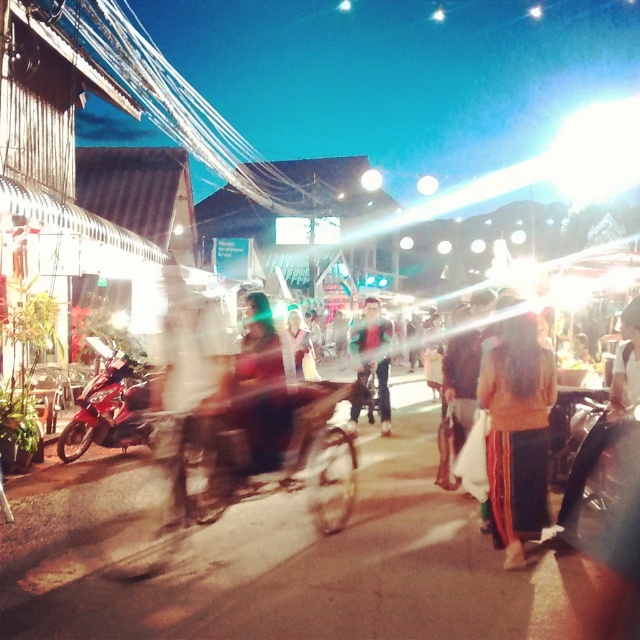
You are standing at the entrance of the market and see the brown fabric skirt at center. If you walk straight ahead, will you reach the skirt before the end of the street?

The position of brown fabric skirt at center is at point (516, 433), which means it is located near the center of the image. Since you are at the entrance, walking straight ahead would lead you towards the center of the image where the skirt is located. Therefore, you will reach the brown fabric skirt at center before the end of the street.

You are a photographer trying to capture a person in the scene. You notice the brown fabric skirt at center and the dark blue jeans at center. Which clothing item is located to the left when focusing on the center of the image?

The brown fabric skirt at center is positioned on the left side of dark blue jeans at center, so the skirt is to the left of the jeans in the center of the image.